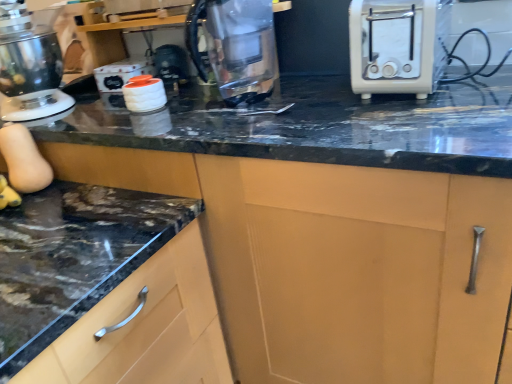
Find the location of a particular element. metallic silver stand mixer at left is located at coordinates (29, 67).

The width and height of the screenshot is (512, 384). Describe the element at coordinates (146, 327) in the screenshot. I see `matte wood cabinet at lower left` at that location.

What are the coordinates of `white glossy canisters at upper center` in the screenshot? It's located at (121, 73).

Describe the element at coordinates (234, 47) in the screenshot. I see `transparent glass kettle at center` at that location.

Locate an element on the screen. The height and width of the screenshot is (384, 512). metallic silver stand mixer at left is located at coordinates (29, 67).

Find the location of a particular element. Image resolution: width=512 pixels, height=384 pixels. toaster located below the white glossy canisters at upper center (from the image's perspective) is located at coordinates (398, 45).

Who is bigger, white glossy canisters at upper center or white plastic toaster at right?

white plastic toaster at right.

Considering the points (134, 61) and (408, 90), which point is behind, point (134, 61) or point (408, 90)?

The point (134, 61) is farther.

Which of these two, white plastic toaster at right or transparent glass kettle at center, stands shorter?

With less height is white plastic toaster at right.

Consider the image. Considering the relative sizes of white plastic toaster at right and transparent glass kettle at center in the image provided, is white plastic toaster at right smaller than transparent glass kettle at center?

Actually, white plastic toaster at right might be larger than transparent glass kettle at center.

Looking at their sizes, would you say white plastic toaster at right is wider or thinner than transparent glass kettle at center?

white plastic toaster at right is wider than transparent glass kettle at center.

Is white plastic toaster at right closer to camera compared to transparent glass kettle at center?

Yes, it is.

Is transparent glass kettle at center directly adjacent to white plastic toaster at right?

No, transparent glass kettle at center is not next to white plastic toaster at right.

The width and height of the screenshot is (512, 384). Identify the location of toaster beneath the transparent glass kettle at center (from a real-world perspective). (398, 45).

Considering the relative sizes of transparent glass kettle at center and white plastic toaster at right in the image provided, is transparent glass kettle at center bigger than white plastic toaster at right?

No.

From a real-world perspective, relative to white plastic toaster at right, is transparent glass kettle at center vertically above or below?

In terms of real-world spatial position, transparent glass kettle at center is above white plastic toaster at right.

From a real-world perspective, which is physically above, matte wood cabinet at lower left or white plastic toaster at right?

white plastic toaster at right.

Based on the photo, is matte wood cabinet at lower left not inside white plastic toaster at right?

Yes, matte wood cabinet at lower left is located beyond the bounds of white plastic toaster at right.

Relative to white plastic toaster at right, is matte wood cabinet at lower left in front or behind?

matte wood cabinet at lower left is positioned closer to the viewer than white plastic toaster at right.

From the image's perspective, between matte wood cabinet at lower left and white plastic toaster at right, which one is located above?

white plastic toaster at right.

Between white plastic toaster at right and metallic silver stand mixer at left, which one is positioned in front?

white plastic toaster at right is in front.

Which is more to the left, white plastic toaster at right or metallic silver stand mixer at left?

From the viewer's perspective, metallic silver stand mixer at left appears more on the left side.

Does white plastic toaster at right turn towards metallic silver stand mixer at left?

No, white plastic toaster at right is not facing towards metallic silver stand mixer at left.

Is white plastic toaster at right positioned far away from metallic silver stand mixer at left?

No.

The width and height of the screenshot is (512, 384). I want to click on cabinetry located on the right of metallic silver stand mixer at left, so click(146, 327).

Which of these two, matte wood cabinet at lower left or metallic silver stand mixer at left, is thinner?

With smaller width is metallic silver stand mixer at left.

Is metallic silver stand mixer at left surrounded by matte wood cabinet at lower left?

No, metallic silver stand mixer at left is not inside matte wood cabinet at lower left.

Which object is further away from the camera taking this photo, matte wood cabinet at lower left or metallic silver stand mixer at left?

metallic silver stand mixer at left is further from the camera.

Can we say white glossy canisters at upper center lies outside transparent glass kettle at center?

white glossy canisters at upper center is positioned outside transparent glass kettle at center.

Does white glossy canisters at upper center come behind transparent glass kettle at center?

Yes, the depth of white glossy canisters at upper center is greater than that of transparent glass kettle at center.

Can you confirm if white glossy canisters at upper center is taller than transparent glass kettle at center?

No, white glossy canisters at upper center is not taller than transparent glass kettle at center.

Which of these two, white glossy canisters at upper center or transparent glass kettle at center, is smaller?

With smaller size is white glossy canisters at upper center.

The image size is (512, 384). I want to click on appliance below the white plastic toaster at right (from a real-world perspective), so click(x=121, y=73).

This screenshot has height=384, width=512. Identify the location of toaster located in front of the transparent glass kettle at center. (398, 45).

When comparing their distances from metallic silver stand mixer at left, does white plastic toaster at right or white glossy canisters at upper center seem closer?

white glossy canisters at upper center is closer to metallic silver stand mixer at left.

Looking at the image, which one is located further to white glossy canisters at upper center, transparent glass kettle at center or white plastic toaster at right?

white plastic toaster at right is further to white glossy canisters at upper center.

Which object lies nearer to the anchor point matte wood cabinet at lower left, transparent glass kettle at center or metallic silver stand mixer at left?

transparent glass kettle at center lies closer to matte wood cabinet at lower left than the other object.

From the image, which object appears to be farther from transparent glass kettle at center, white plastic toaster at right or matte wood cabinet at lower left?

Based on the image, matte wood cabinet at lower left appears to be further to transparent glass kettle at center.

Considering their positions, is metallic silver stand mixer at left positioned closer to white glossy canisters at upper center than matte wood cabinet at lower left?

→ metallic silver stand mixer at left is closer to white glossy canisters at upper center.

In the scene shown: Estimate the real-world distances between objects in this image. Which object is closer to transparent glass kettle at center, metallic silver stand mixer at left or white plastic toaster at right?

white plastic toaster at right.

Estimate the real-world distances between objects in this image. Which object is closer to white glossy canisters at upper center, white plastic toaster at right or matte wood cabinet at lower left?

matte wood cabinet at lower left is positioned closer to the anchor white glossy canisters at upper center.

Looking at the image, which one is located further to matte wood cabinet at lower left, transparent glass kettle at center or white plastic toaster at right?

The object further to matte wood cabinet at lower left is white plastic toaster at right.

Identify the location of appliance between metallic silver stand mixer at left and matte wood cabinet at lower left from top to bottom. Image resolution: width=512 pixels, height=384 pixels. (121, 73).

Locate an element on the screen. The image size is (512, 384). kitchen appliance between metallic silver stand mixer at left and white plastic toaster at right in the horizontal direction is located at coordinates (234, 47).

I want to click on appliance located between matte wood cabinet at lower left and white plastic toaster at right in the left-right direction, so click(x=121, y=73).

The image size is (512, 384). In order to click on cabinetry between metallic silver stand mixer at left and white plastic toaster at right in this screenshot , I will do `click(146, 327)`.